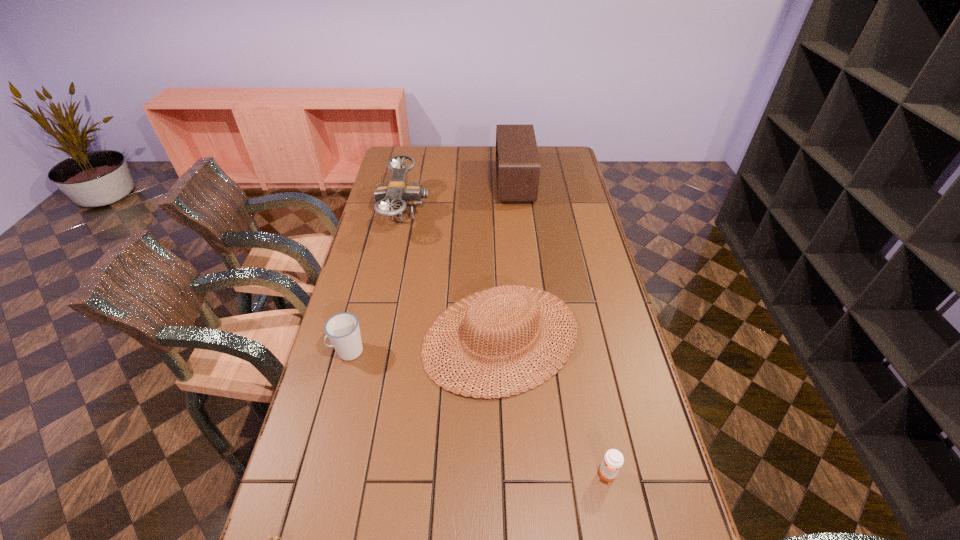
At what (x,y) coordinates should I click in order to perform the action: click on radio receiver. Please return your answer as a coordinate pair (x, y). This screenshot has width=960, height=540. Looking at the image, I should click on (517, 159).

This screenshot has height=540, width=960. Identify the location of the second tallest object. (397, 192).

Locate an element on the screen. Image resolution: width=960 pixels, height=540 pixels. sunhat is located at coordinates (529, 302).

Identify the location of cup. The width and height of the screenshot is (960, 540). (342, 329).

Find the location of a particular element. the second shortest object is located at coordinates (613, 460).

Image resolution: width=960 pixels, height=540 pixels. What are the coordinates of `medicine` in the screenshot? It's located at (613, 460).

The height and width of the screenshot is (540, 960). I want to click on free location located on the front-facing side of the tallest object, so click(x=406, y=183).

Where is `vacant space located on the front-facing side of the tallest object`? The image size is (960, 540). vacant space located on the front-facing side of the tallest object is located at coordinates (443, 183).

Where is `vacant position located on the front-facing side of the tallest object`? This screenshot has width=960, height=540. vacant position located on the front-facing side of the tallest object is located at coordinates (458, 183).

Locate an element on the screen. The width and height of the screenshot is (960, 540). vacant space located 0.090m on the front-facing side of the fifth shortest object is located at coordinates (452, 213).